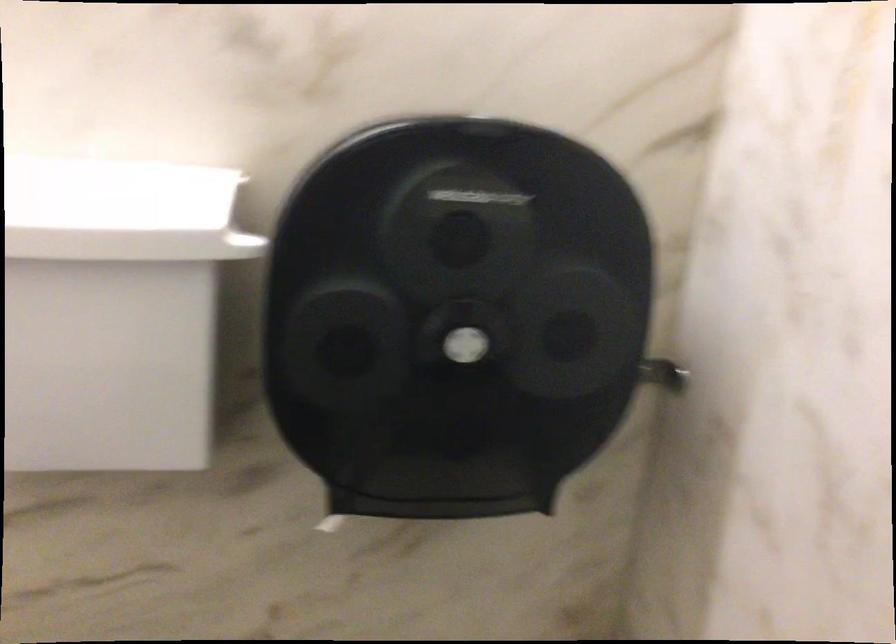
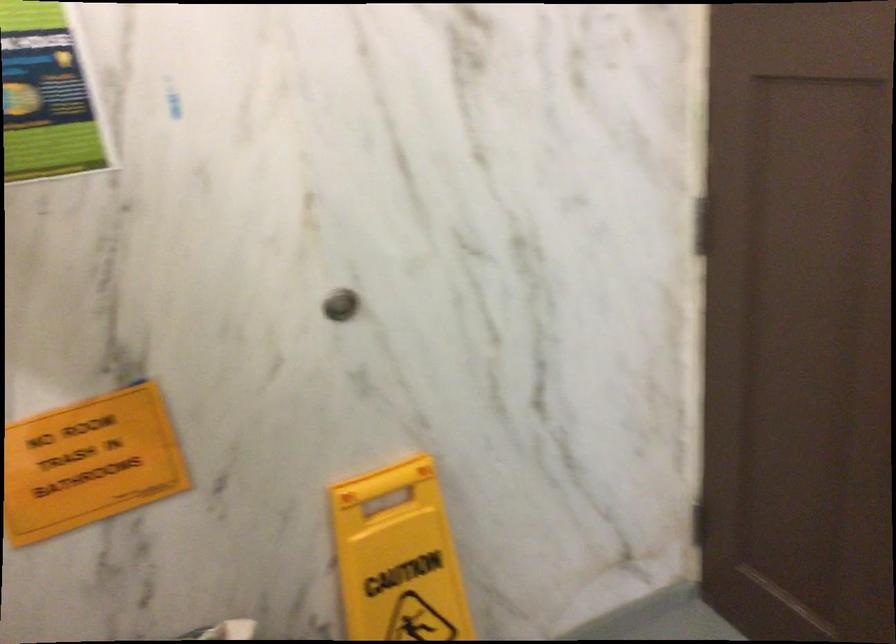
First-person continuous shooting, in which direction is the camera rotating?

The camera's rotation is toward right-down.